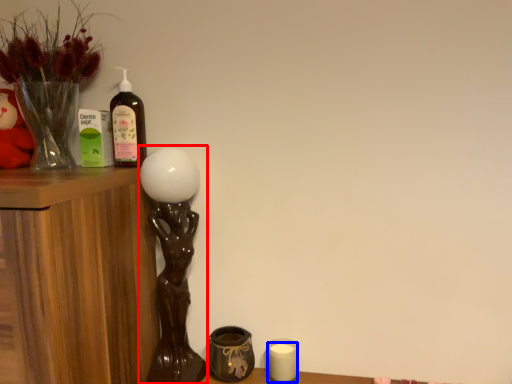
Question: Among these objects, which one is farthest to the camera, table lamp (highlighted by a red box) or candle (highlighted by a blue box)?

Choices:
 (A) table lamp
 (B) candle

Answer: (B)